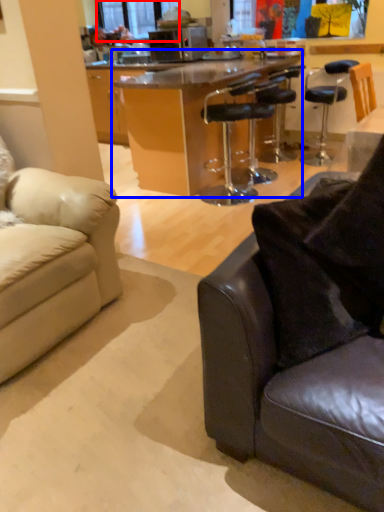
Question: Which point is closer to the camera, window screen (highlighted by a red box) or table (highlighted by a blue box)?

Choices:
 (A) window screen
 (B) table

Answer: (B)